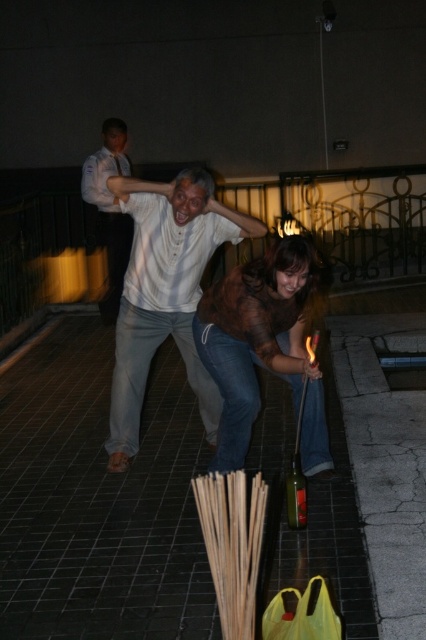
Can you confirm if white matte shirt at center is wider than matte brown sweater at center?

Indeed, white matte shirt at center has a greater width compared to matte brown sweater at center.

Can you confirm if white matte shirt at center is shorter than matte brown sweater at center?

In fact, white matte shirt at center may be taller than matte brown sweater at center.

Does point (209, 417) come closer to viewer compared to point (328, 456)?

No, it is behind (328, 456).

Locate an element on the screen. The width and height of the screenshot is (426, 640). white matte shirt at center is located at coordinates pyautogui.click(x=166, y=292).

Is matte brown sweater at center to the right of white shirt at upper center from the viewer's perspective?

Yes, matte brown sweater at center is to the right of white shirt at upper center.

Consider the image. Is matte brown sweater at center thinner than white shirt at upper center?

Incorrect, matte brown sweater at center's width is not less than white shirt at upper center's.

Which is behind, point (302, 332) or point (114, 224)?

The point (114, 224) is more distant.

Find the location of a particular element. matte brown sweater at center is located at coordinates [264, 346].

Measure the distance from white matte shirt at center to white shirt at upper center.

white matte shirt at center and white shirt at upper center are 3.33 meters apart from each other.

Who is higher up, white matte shirt at center or white shirt at upper center?

white shirt at upper center

This screenshot has width=426, height=640. What are the coordinates of `white matte shirt at center` in the screenshot? It's located at (166, 292).